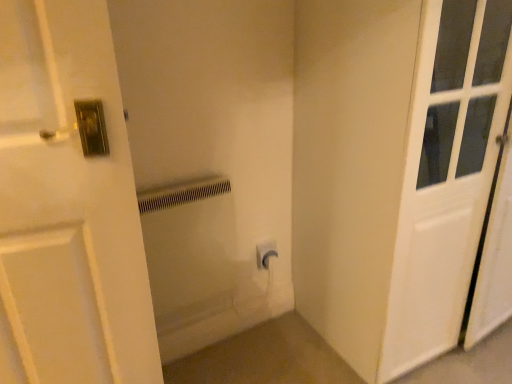
Locate an element on the screen. This screenshot has width=512, height=384. free space above white plastic radiator at center (from a real-world perspective) is located at coordinates (182, 188).